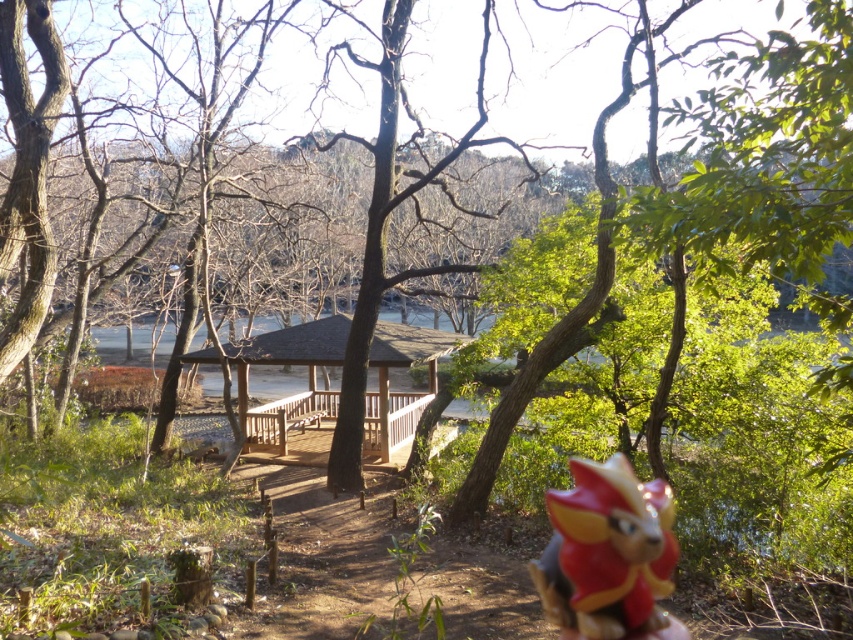
Question: Observing the image, what is the correct spatial positioning of shiny plastic toy at lower right in reference to wooden gazebo at center?

Choices:
 (A) left
 (B) right

Answer: (B)

Question: Which object is farther from the camera taking this photo?

Choices:
 (A) shiny plastic toy at lower right
 (B) wooden gazebo at center

Answer: (B)

Question: In this image, where is shiny plastic toy at lower right located relative to wooden gazebo at center?

Choices:
 (A) left
 (B) right

Answer: (B)

Question: Is shiny plastic toy at lower right to the right of wooden gazebo at center from the viewer's perspective?

Choices:
 (A) yes
 (B) no

Answer: (A)

Question: Which of the following is the closest to the observer?

Choices:
 (A) (564, 598)
 (B) (407, 426)

Answer: (A)